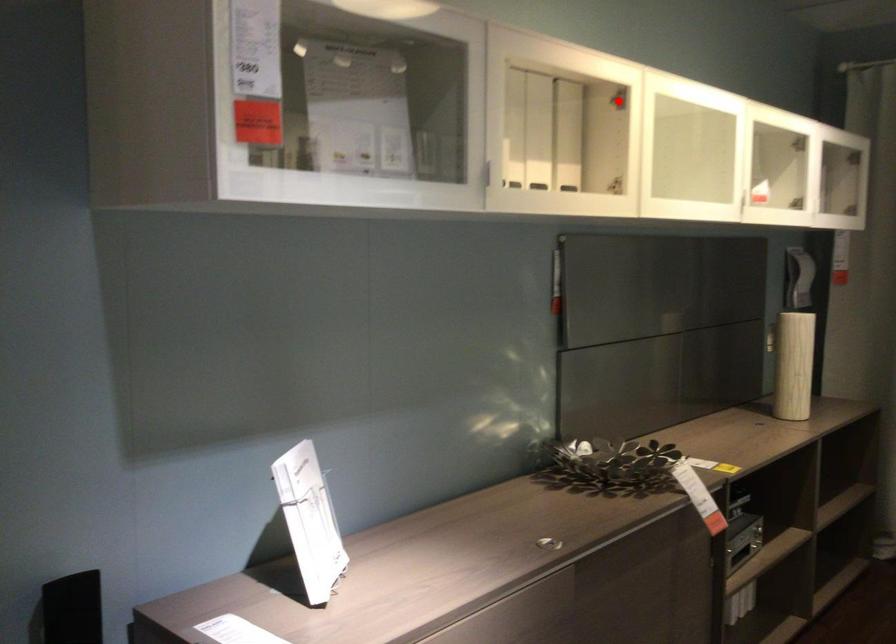
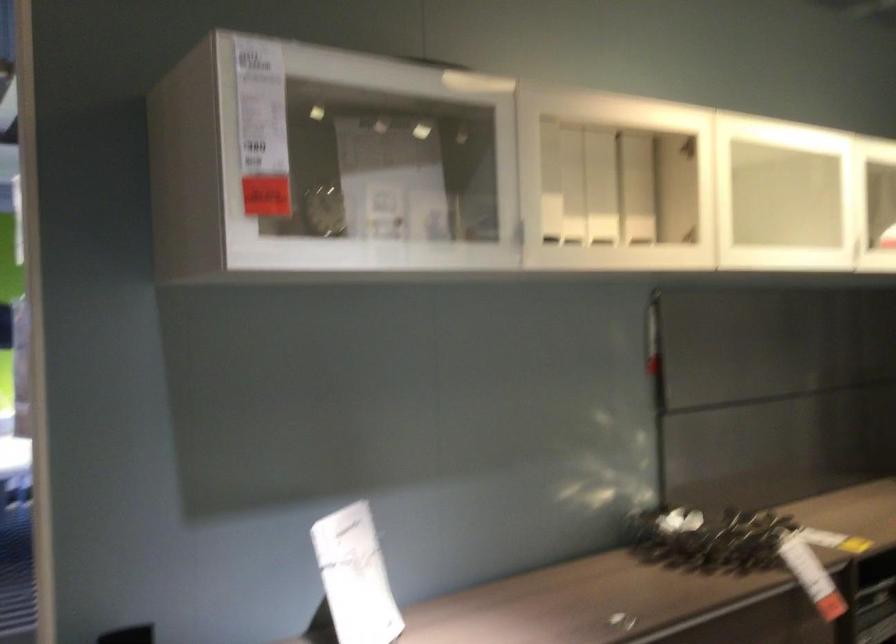
In the second image, find the point that corresponds to the highlighted location in the first image.

(688, 147)